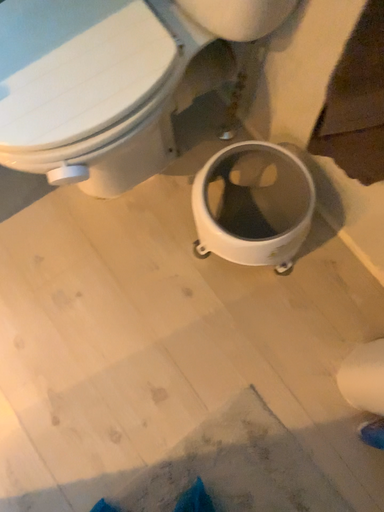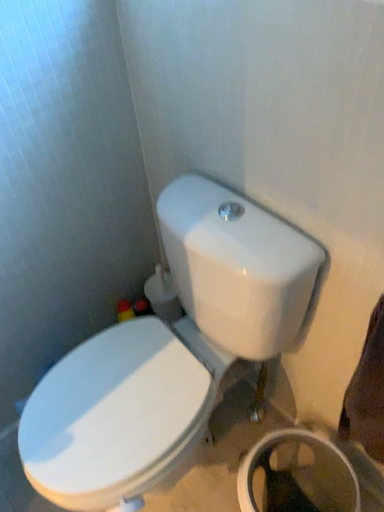
Question: How did the camera likely rotate when shooting the video?

Choices:
 (A) rotated downward
 (B) rotated upward

Answer: (B)